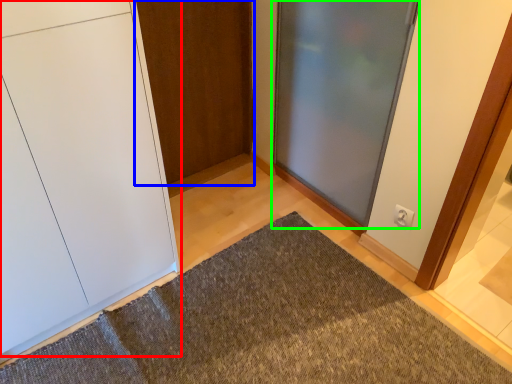
Question: Which object is positioned farthest from door (highlighted by a red box)? Select from door (highlighted by a blue box) and door (highlighted by a green box).

Choices:
 (A) door
 (B) door

Answer: (B)